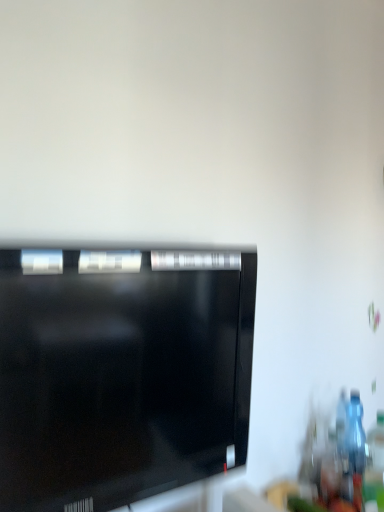
Question: From a real-world perspective, relative to black glossy television at center, is transparent plastic bottle at right vertically above or below?

Choices:
 (A) above
 (B) below

Answer: (B)

Question: Is point (357, 413) positioned closer to the camera than point (208, 414)?

Choices:
 (A) farther
 (B) closer

Answer: (A)

Question: In terms of height, does transparent plastic bottle at right look taller or shorter compared to black glossy television at center?

Choices:
 (A) tall
 (B) short

Answer: (B)

Question: In the image, is black glossy television at center positioned in front of or behind transparent plastic bottle at right?

Choices:
 (A) behind
 (B) front

Answer: (B)

Question: Considering the positions of black glossy television at center and transparent plastic bottle at right in the image, is black glossy television at center wider or thinner than transparent plastic bottle at right?

Choices:
 (A) thin
 (B) wide

Answer: (B)

Question: From a real-world perspective, relative to transparent plastic bottle at right, is black glossy television at center vertically above or below?

Choices:
 (A) below
 (B) above

Answer: (B)

Question: From the image's perspective, is black glossy television at center located above or below transparent plastic bottle at right?

Choices:
 (A) below
 (B) above

Answer: (B)